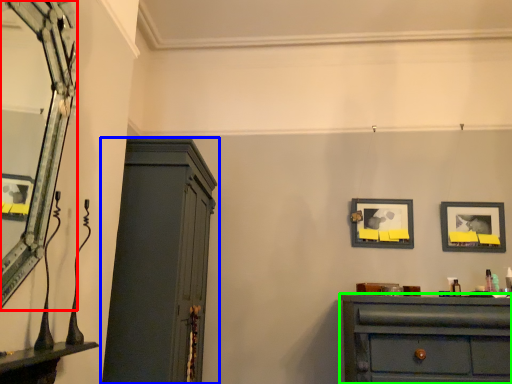
Question: Which object is the farthest from mirror (highlighted by a red box)? Choose among these: cupboard (highlighted by a blue box) or chest of drawers (highlighted by a green box).

Choices:
 (A) cupboard
 (B) chest of drawers

Answer: (B)